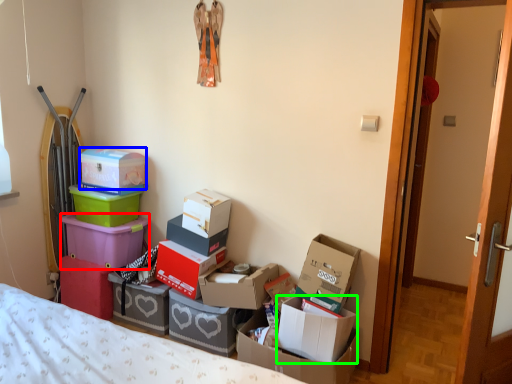
Question: Which object is the farthest from box (highlighted by a red box)? Choose among these: box (highlighted by a blue box) or box (highlighted by a green box).

Choices:
 (A) box
 (B) box

Answer: (B)